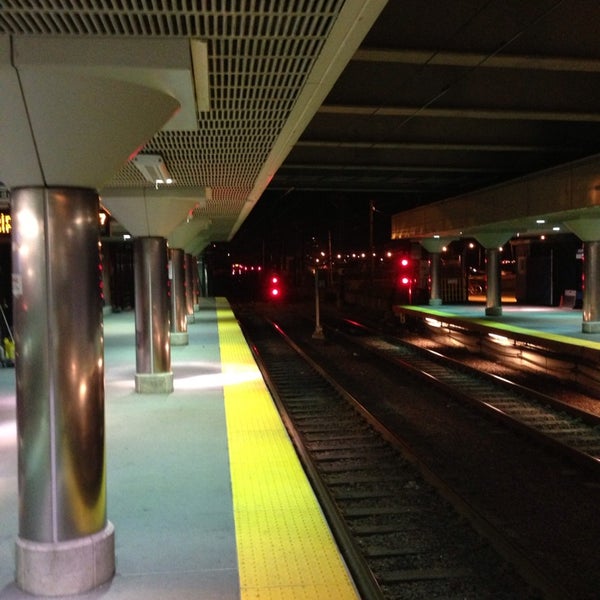
Find the location of a particular element. This screenshot has height=600, width=600. metal columns is located at coordinates (77, 406), (154, 323), (180, 308), (190, 297), (194, 290), (436, 276), (494, 280), (591, 286).